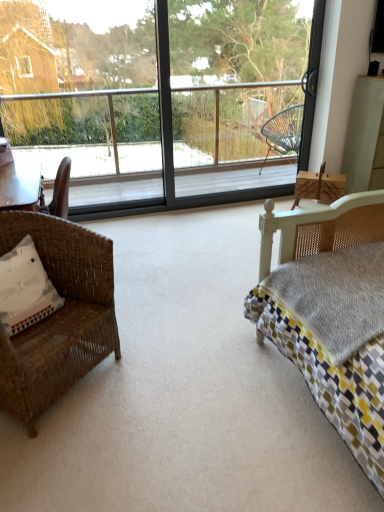
Question: Is transparent glass screen door at center looking in the opposite direction of white fabric pillow at left?

Choices:
 (A) yes
 (B) no

Answer: (B)

Question: Does transparent glass screen door at center have a smaller size compared to white fabric pillow at left?

Choices:
 (A) yes
 (B) no

Answer: (B)

Question: Are transparent glass screen door at center and white fabric pillow at left beside each other?

Choices:
 (A) no
 (B) yes

Answer: (A)

Question: From a real-world perspective, is transparent glass screen door at center physically above white fabric pillow at left?

Choices:
 (A) yes
 (B) no

Answer: (A)

Question: Can you confirm if transparent glass screen door at center is bigger than white fabric pillow at left?

Choices:
 (A) yes
 (B) no

Answer: (A)

Question: From a real-world perspective, is woven brown chair at left positioned above or below transparent glass screen door at center?

Choices:
 (A) above
 (B) below

Answer: (B)

Question: Would you say woven brown chair at left is inside or outside transparent glass screen door at center?

Choices:
 (A) inside
 (B) outside

Answer: (B)

Question: In the image, is woven brown chair at left on the left side or the right side of transparent glass screen door at center?

Choices:
 (A) left
 (B) right

Answer: (A)

Question: In the image, is woven brown chair at left positioned in front of or behind transparent glass screen door at center?

Choices:
 (A) behind
 (B) front

Answer: (B)

Question: Do you think white fabric pillow at left is within transparent glass screen door at center, or outside of it?

Choices:
 (A) inside
 (B) outside

Answer: (B)

Question: Considering the positions of white fabric pillow at left and transparent glass screen door at center in the image, is white fabric pillow at left bigger or smaller than transparent glass screen door at center?

Choices:
 (A) big
 (B) small

Answer: (B)

Question: From a real-world perspective, is white fabric pillow at left positioned above or below transparent glass screen door at center?

Choices:
 (A) below
 (B) above

Answer: (A)

Question: From the image's perspective, is white fabric pillow at left located above or below transparent glass screen door at center?

Choices:
 (A) above
 (B) below

Answer: (B)

Question: Considering the positions of point (276, 34) and point (13, 356), is point (276, 34) closer or farther from the camera than point (13, 356)?

Choices:
 (A) closer
 (B) farther

Answer: (B)

Question: In terms of height, does transparent glass window at center look taller or shorter compared to woven brown chair at left?

Choices:
 (A) short
 (B) tall

Answer: (B)